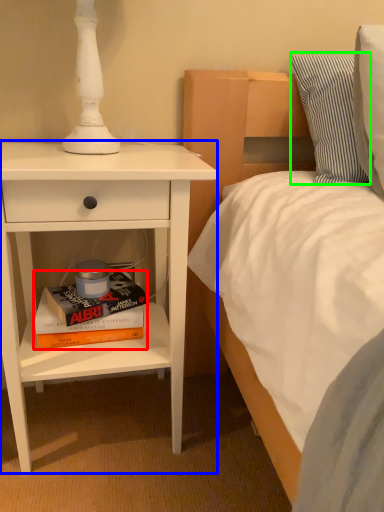
Question: Considering the real-world distances, which object is closest to book (highlighted by a red box)? nightstand (highlighted by a blue box) or pillow (highlighted by a green box).

Choices:
 (A) nightstand
 (B) pillow

Answer: (A)